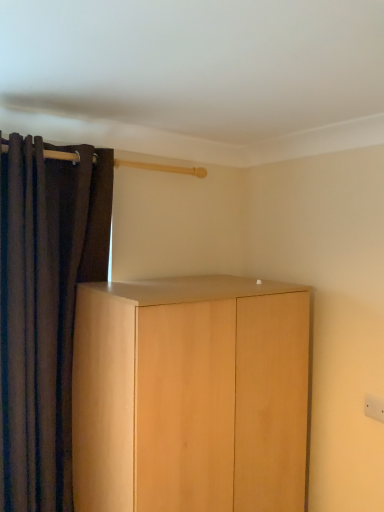
Question: Is light wood cabinet at center looking in the opposite direction of brown velvet curtain at left?

Choices:
 (A) yes
 (B) no

Answer: (B)

Question: From a real-world perspective, is light wood cabinet at center physically below brown velvet curtain at left?

Choices:
 (A) no
 (B) yes

Answer: (B)

Question: Is light wood cabinet at center bigger than brown velvet curtain at left?

Choices:
 (A) no
 (B) yes

Answer: (B)

Question: Would you say light wood cabinet at center contains brown velvet curtain at left?

Choices:
 (A) yes
 (B) no

Answer: (B)

Question: Does light wood cabinet at center come behind brown velvet curtain at left?

Choices:
 (A) yes
 (B) no

Answer: (B)

Question: From a real-world perspective, is light wood cabinet at center on brown velvet curtain at left?

Choices:
 (A) yes
 (B) no

Answer: (B)

Question: Does brown velvet curtain at left have a greater width compared to light wood cabinet at center?

Choices:
 (A) no
 (B) yes

Answer: (A)

Question: Considering the relative positions of brown velvet curtain at left and light wood cabinet at center in the image provided, is brown velvet curtain at left behind light wood cabinet at center?

Choices:
 (A) no
 (B) yes

Answer: (B)

Question: Is light wood cabinet at center at the back of brown velvet curtain at left?

Choices:
 (A) yes
 (B) no

Answer: (B)

Question: Can we say brown velvet curtain at left lies outside light wood cabinet at center?

Choices:
 (A) yes
 (B) no

Answer: (A)

Question: Is brown velvet curtain at left bigger than light wood cabinet at center?

Choices:
 (A) yes
 (B) no

Answer: (B)

Question: Is light wood cabinet at center surrounded by brown velvet curtain at left?

Choices:
 (A) no
 (B) yes

Answer: (A)

Question: Considering the positions of light wood cabinet at center and brown velvet curtain at left in the image, is light wood cabinet at center taller or shorter than brown velvet curtain at left?

Choices:
 (A) tall
 (B) short

Answer: (B)